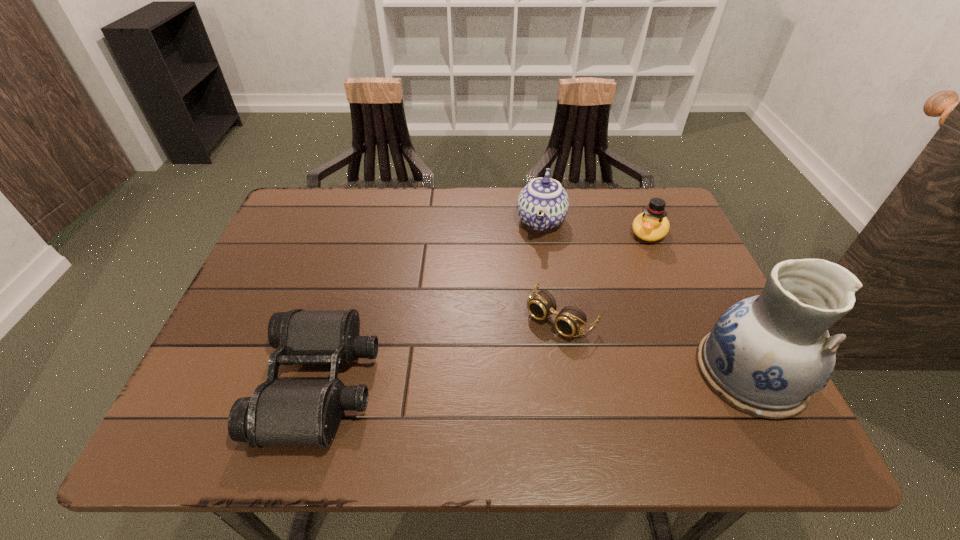
This screenshot has height=540, width=960. Identify the location of vacant space at the right edge of the desktop. (660, 272).

The width and height of the screenshot is (960, 540). I want to click on free region at the far left corner, so click(x=343, y=194).

Where is `vacant space that is in between the duck and the shortest object`? Image resolution: width=960 pixels, height=540 pixels. vacant space that is in between the duck and the shortest object is located at coordinates (605, 275).

Where is `free space that is in between the shortest object and the third shortest object`? free space that is in between the shortest object and the third shortest object is located at coordinates (605, 275).

Locate an element on the screen. vacant region between the chinaware and the third tallest object is located at coordinates (594, 227).

Where is `free space that is in between the tallest object and the chinaware`? This screenshot has height=540, width=960. free space that is in between the tallest object and the chinaware is located at coordinates (645, 296).

Identify the location of free space that is in between the tallest object and the duck. The image size is (960, 540). (699, 302).

Identify the location of vacant area that lies between the goggles and the fourth shortest object. The width and height of the screenshot is (960, 540). (551, 269).

Locate an element on the screen. This screenshot has height=540, width=960. vacant area that lies between the third shortest object and the tallest object is located at coordinates (699, 302).

Find the location of a particular element. This screenshot has width=960, height=540. vacant point located between the pottery and the shortest object is located at coordinates 655,345.